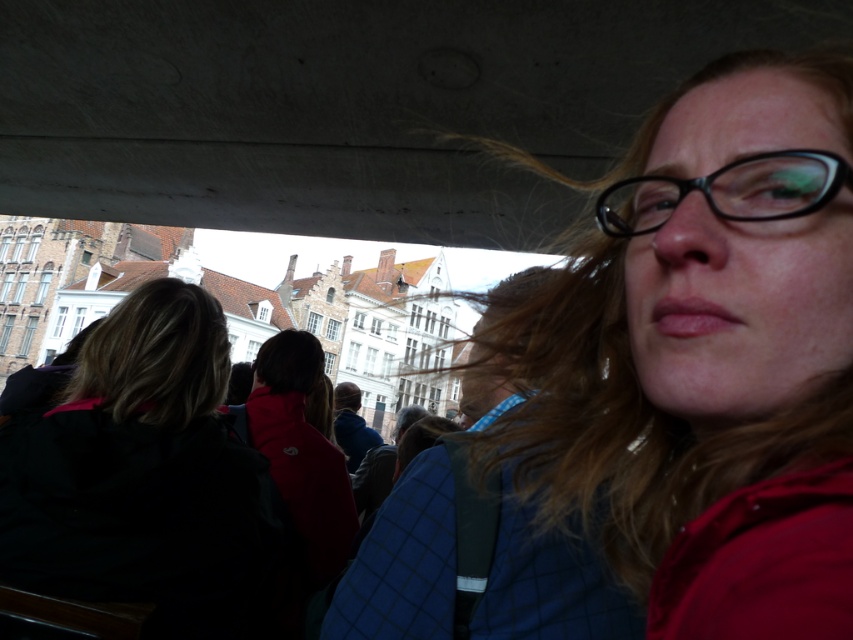
Question: Based on their relative distances, which object is nearer to the dark brown hair at center?

Choices:
 (A) matte black glasses at upper right
 (B) black plastic glasses at upper right

Answer: (A)

Question: Can you confirm if matte black glasses at upper right is positioned above dark brown hair at center?

Choices:
 (A) yes
 (B) no

Answer: (A)

Question: Does matte black glasses at upper right appear on the right side of dark brown hair at center?

Choices:
 (A) no
 (B) yes

Answer: (B)

Question: Which of the following is the closest to the observer?

Choices:
 (A) black plastic glasses at upper right
 (B) matte black glasses at upper right
 (C) dark brown hair at center

Answer: (B)

Question: Which object is positioned closest to the dark brown hair at center?

Choices:
 (A) matte black glasses at upper right
 (B) black plastic glasses at upper right

Answer: (A)

Question: Observing the image, what is the correct spatial positioning of matte black glasses at upper right in reference to black plastic glasses at upper right?

Choices:
 (A) left
 (B) right

Answer: (A)